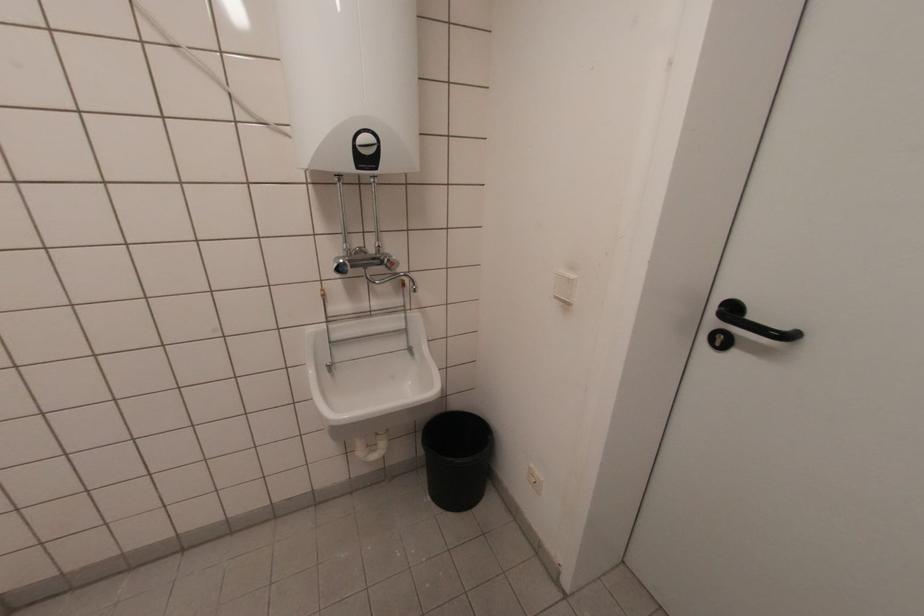
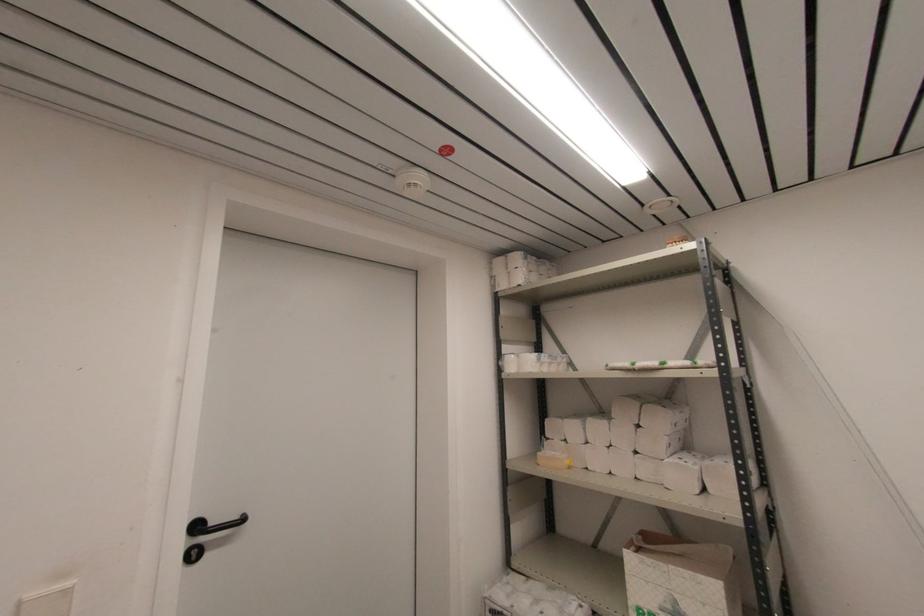
Question: The camera is either moving clockwise (left) or counter-clockwise (right) around the object. The first image is from the beginning of the video and the second image is from the end. Is the camera moving left or right when shooting the video?

Choices:
 (A) Left
 (B) Right

Answer: (A)